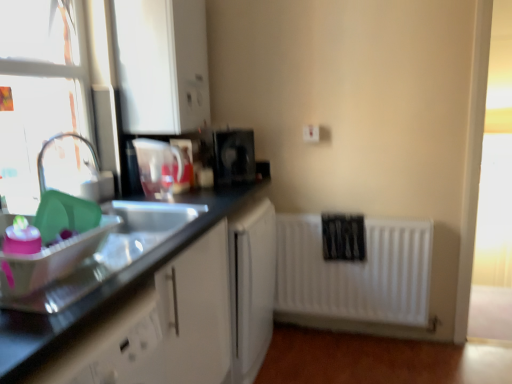
Question: Can you confirm if translucent plastic pitcher at upper center, acting as the 2th appliance starting from the right, is taller than black plastic coffee maker at center, the second appliance positioned from the left?

Choices:
 (A) yes
 (B) no

Answer: (A)

Question: Considering the relative sizes of translucent plastic pitcher at upper center, the 2th appliance viewed from the back, and black plastic coffee maker at center, which is counted as the second appliance, starting from the front, in the image provided, is translucent plastic pitcher at upper center, the 2th appliance viewed from the back, shorter than black plastic coffee maker at center, which is counted as the second appliance, starting from the front,?

Choices:
 (A) yes
 (B) no

Answer: (B)

Question: Is translucent plastic pitcher at upper center, the 1th appliance viewed from the left, smaller than black plastic coffee maker at center, which is the 1th appliance from right to left?

Choices:
 (A) yes
 (B) no

Answer: (A)

Question: Is translucent plastic pitcher at upper center, acting as the 2th appliance starting from the right, looking in the opposite direction of black plastic coffee maker at center, which is the 1th appliance from right to left?

Choices:
 (A) yes
 (B) no

Answer: (B)

Question: From the image's perspective, does translucent plastic pitcher at upper center, which is the first appliance in front-to-back order, appear higher than black plastic coffee maker at center, which is the 1th appliance from right to left?

Choices:
 (A) no
 (B) yes

Answer: (A)

Question: Is point (140, 140) positioned closer to the camera than point (313, 125)?

Choices:
 (A) closer
 (B) farther

Answer: (A)

Question: Considering the positions of translucent plastic pitcher at upper center, the 1th appliance viewed from the left, and white plastic electric outlet at upper center in the image, is translucent plastic pitcher at upper center, the 1th appliance viewed from the left, bigger or smaller than white plastic electric outlet at upper center?

Choices:
 (A) small
 (B) big

Answer: (B)

Question: In terms of width, does translucent plastic pitcher at upper center, acting as the 2th appliance starting from the right, look wider or thinner when compared to white plastic electric outlet at upper center?

Choices:
 (A) thin
 (B) wide

Answer: (B)

Question: In terms of height, does translucent plastic pitcher at upper center, acting as the 2th appliance starting from the right, look taller or shorter compared to white plastic electric outlet at upper center?

Choices:
 (A) tall
 (B) short

Answer: (A)

Question: From the image's perspective, relative to translucent plastic pitcher at upper center, which is the first appliance in front-to-back order, is white plastic electric outlet at upper center above or below?

Choices:
 (A) below
 (B) above

Answer: (B)

Question: In the image, is white plastic electric outlet at upper center on the left side or the right side of translucent plastic pitcher at upper center, acting as the 2th appliance starting from the right?

Choices:
 (A) left
 (B) right

Answer: (B)

Question: Looking at their shapes, would you say white plastic electric outlet at upper center is wider or thinner than translucent plastic pitcher at upper center, which is the first appliance in front-to-back order?

Choices:
 (A) thin
 (B) wide

Answer: (A)

Question: From a real-world perspective, is white plastic electric outlet at upper center physically located above or below translucent plastic pitcher at upper center, which is the first appliance in front-to-back order?

Choices:
 (A) below
 (B) above

Answer: (B)

Question: Relative to white matte radiator at lower right, is black plastic coffee maker at center, which appears as the 1th appliance when viewed from the back, in front or behind?

Choices:
 (A) behind
 (B) front

Answer: (B)

Question: Is black plastic coffee maker at center, the second appliance positioned from the left, inside the boundaries of white matte radiator at lower right, or outside?

Choices:
 (A) outside
 (B) inside

Answer: (A)